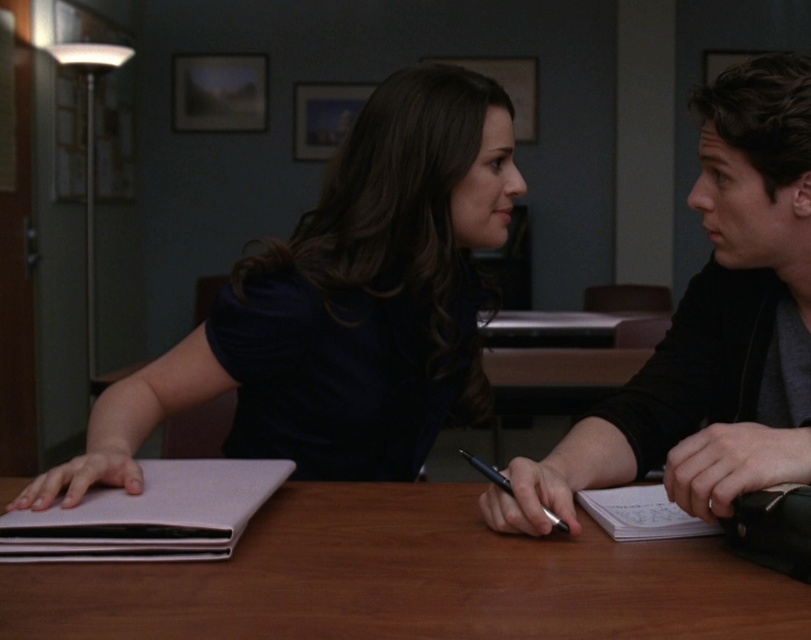
Question: Can you confirm if matte black laptop at center is wider than wooden table at center?

Choices:
 (A) no
 (B) yes

Answer: (A)

Question: Which object is the farthest from the wooden table at center?

Choices:
 (A) black matte jacket at right
 (B) matte white notepad at left

Answer: (A)

Question: Can you confirm if black matte jacket at right is smaller than black metallic pen at lower center?

Choices:
 (A) no
 (B) yes

Answer: (A)

Question: Which object is closer to the camera taking this photo?

Choices:
 (A) wooden table at center
 (B) matte white notepad at left
 (C) white paper notepad at center

Answer: (A)

Question: Is white paper notepad at center positioned in front of black metallic pen at lower center?

Choices:
 (A) yes
 (B) no

Answer: (B)

Question: Which object appears closest to the camera in this image?

Choices:
 (A) black metallic pen at lower center
 (B) matte black laptop at center
 (C) matte white notepad at left
 (D) wooden table at center

Answer: (D)